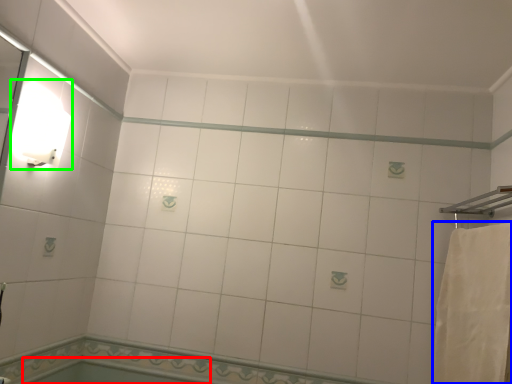
Question: Estimate the real-world distances between objects in this image. Which object is closer to bath (highlighted by a red box), bath towel (highlighted by a blue box) or light fixture (highlighted by a green box)?

Choices:
 (A) bath towel
 (B) light fixture

Answer: (B)